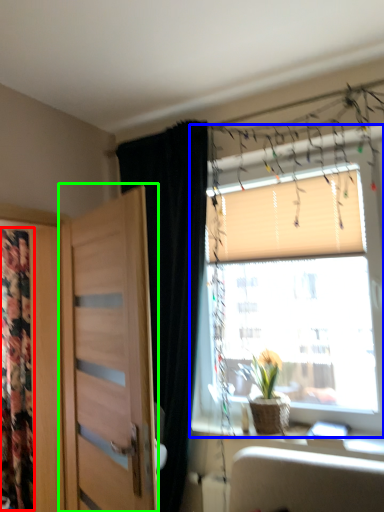
Question: Which is nearer to the tapestry (highlighted by a red box)? window (highlighted by a blue box) or door (highlighted by a green box).

Choices:
 (A) window
 (B) door

Answer: (B)